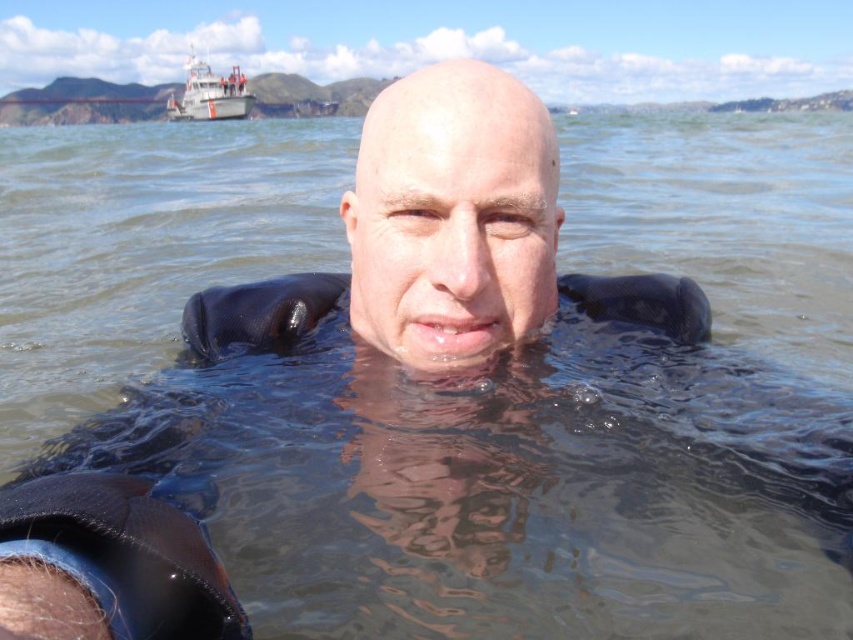
Who is more distant from viewer, (x=445, y=285) or (x=248, y=106)?

Point (x=248, y=106)

Is point (403, 129) closer to camera compared to point (166, 106)?

That is True.

Is point (495, 317) farther from viewer compared to point (239, 106)?

No.

What are the coordinates of `matte black head at center` in the screenshot? It's located at (451, 216).